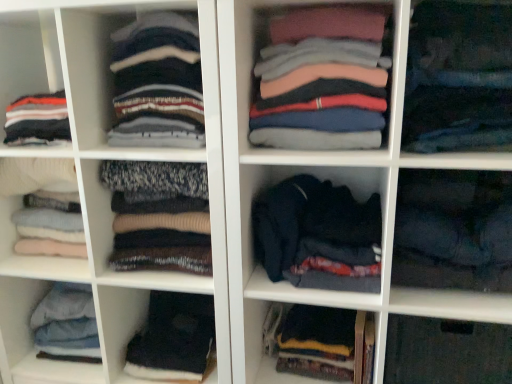
What do you see at coordinates (33, 174) in the screenshot?
I see `knit sweater at left, which is the 1th clothing from left to right` at bounding box center [33, 174].

Image resolution: width=512 pixels, height=384 pixels. What do you see at coordinates (321, 80) in the screenshot?
I see `pink cotton shirts at center, the fifth clothing viewed from the left` at bounding box center [321, 80].

This screenshot has width=512, height=384. Identify the location of pink cotton shirts at center, the fifth clothing viewed from the left. (321, 80).

What do you see at coordinates (453, 230) in the screenshot? I see `dark blue fabric at lower right, which ranks as the ninth clothing in left-to-right order` at bounding box center [453, 230].

Identify the location of dark blue fabric pants at center, which is counted as the eighth clothing, starting from the left. The width and height of the screenshot is (512, 384). (458, 78).

Image resolution: width=512 pixels, height=384 pixels. Describe the element at coordinates (157, 83) in the screenshot. I see `knit sweater at center, acting as the seventh clothing starting from the right` at that location.

Find the location of `dark blue fabric at lower center, which is the 6th clothing in left-to-right order`. dark blue fabric at lower center, which is the 6th clothing in left-to-right order is located at coordinates (321, 342).

This screenshot has height=384, width=512. What are the coordinates of `knit sweater at left, the ninth clothing in the right-to-left sequence` in the screenshot? It's located at (33, 174).

From the image's perspective, which is below, dark blue fabric at lower center, acting as the fourth clothing starting from the right, or knit sweater at left, which is the 1th clothing from left to right?

dark blue fabric at lower center, acting as the fourth clothing starting from the right, is shown below in the image.

Which point is more forward, (347, 325) or (70, 166)?

The point (70, 166) is more forward.

Visually, is dark blue fabric at lower center, which is the 6th clothing in left-to-right order, positioned to the left or to the right of knit sweater at left, the ninth clothing in the right-to-left sequence?

Based on their positions, dark blue fabric at lower center, which is the 6th clothing in left-to-right order, is located to the right of knit sweater at left, the ninth clothing in the right-to-left sequence.

Which point is more forward, (337, 55) or (1, 182)?

The point (337, 55) is closer.

What's the angular difference between pink cotton shirts at center, the fifth clothing viewed from the left, and knit sweater at left, the ninth clothing in the right-to-left sequence,'s facing directions?

The angle between the facing direction of pink cotton shirts at center, the fifth clothing viewed from the left, and the facing direction of knit sweater at left, the ninth clothing in the right-to-left sequence, is 0.000122 degrees.

Is pink cotton shirts at center, which is the fifth clothing from right to left, facing towards knit sweater at left, the ninth clothing in the right-to-left sequence?

No, pink cotton shirts at center, which is the fifth clothing from right to left, is not facing towards knit sweater at left, the ninth clothing in the right-to-left sequence.

Which of these two, dark blue sweater at center or pink cotton shirts at center, which is the fifth clothing from right to left, is smaller?

pink cotton shirts at center, which is the fifth clothing from right to left.

Is dark blue sweater at center to the left of pink cotton shirts at center, the fifth clothing viewed from the left, from the viewer's perspective?

Yes.

Is dark blue sweater at center aimed at pink cotton shirts at center, the fifth clothing viewed from the left?

No, dark blue sweater at center is not facing towards pink cotton shirts at center, the fifth clothing viewed from the left.

Which object is more forward, dark blue sweater at center or pink cotton shirts at center, the fifth clothing viewed from the left?

dark blue sweater at center.

From the picture: Is dark blue fabric at center, which is the 7th clothing in left-to-right order, at the back of dark blue fabric at lower center, which is the 6th clothing in left-to-right order?

No, dark blue fabric at center, which is the 7th clothing in left-to-right order, is not at the back of dark blue fabric at lower center, which is the 6th clothing in left-to-right order.

Is dark blue fabric at lower center, acting as the fourth clothing starting from the right, next to dark blue fabric at center, the third clothing viewed from the right?

No, dark blue fabric at lower center, acting as the fourth clothing starting from the right, is not with dark blue fabric at center, the third clothing viewed from the right.

Which object is more forward, dark blue fabric at lower center, which is the 6th clothing in left-to-right order, or dark blue fabric at center, which is the 7th clothing in left-to-right order?

Positioned in front is dark blue fabric at center, which is the 7th clothing in left-to-right order.

Is dark blue fabric at lower right, which ranks as the ninth clothing in left-to-right order, thinner than dark blue fabric pants at center, the second clothing viewed from the right?

No.

Considering the positions of objects dark blue fabric at lower right, the first clothing when ordered from right to left, and dark blue fabric pants at center, the second clothing viewed from the right, in the image provided, who is more to the left, dark blue fabric at lower right, the first clothing when ordered from right to left, or dark blue fabric pants at center, the second clothing viewed from the right,?

From the viewer's perspective, dark blue fabric pants at center, the second clothing viewed from the right, appears more on the left side.

Are dark blue fabric at lower right, which ranks as the ninth clothing in left-to-right order, and dark blue fabric pants at center, the second clothing viewed from the right, far apart?

No, dark blue fabric at lower right, which ranks as the ninth clothing in left-to-right order, is not far from dark blue fabric pants at center, the second clothing viewed from the right.

From a real-world perspective, is dark blue fabric at lower right, which ranks as the ninth clothing in left-to-right order, under dark blue fabric pants at center, the second clothing viewed from the right?

Correct, in the physical world, dark blue fabric at lower right, which ranks as the ninth clothing in left-to-right order, is lower than dark blue fabric pants at center, the second clothing viewed from the right.

From a real-world perspective, who is located lower, knit sweater at center, acting as the second clothing starting from the left, or dark blue fabric at lower right, the first clothing when ordered from right to left?

knit sweater at center, acting as the second clothing starting from the left, from a real-world perspective.

Which clothing is the 4th one when counting from the front of the knit sweater at center, acting as the second clothing starting from the left? Please provide its 2D coordinates.

[(453, 230)]

From the image's perspective, is knit sweater at center, placed as the 8th clothing when sorted from right to left, located above or below dark blue fabric at lower right, the first clothing when ordered from right to left?

Clearly, from the image's perspective, knit sweater at center, placed as the 8th clothing when sorted from right to left, is above dark blue fabric at lower right, the first clothing when ordered from right to left.

In the scene shown: Is knit sweater at center, acting as the second clothing starting from the left, positioned with its back to dark blue fabric at lower right, which ranks as the ninth clothing in left-to-right order?

No, knit sweater at center, acting as the second clothing starting from the left, is not facing the opposite direction of dark blue fabric at lower right, which ranks as the ninth clothing in left-to-right order.

Considering the positions of objects dark blue fabric at center, the third clothing viewed from the right, and dark blue sweater at center in the image provided, who is more to the right, dark blue fabric at center, the third clothing viewed from the right, or dark blue sweater at center?

Positioned to the right is dark blue fabric at center, the third clothing viewed from the right.

Is dark blue fabric at center, the third clothing viewed from the right, positioned far away from dark blue sweater at center?

They are positioned close to each other.

Who is bigger, dark blue fabric at center, which is the 7th clothing in left-to-right order, or dark blue sweater at center?

Bigger between the two is dark blue sweater at center.

Which is nearer, (289, 244) or (88, 253)?

The point (289, 244) is more forward.

From the knit sweater at left, the ninth clothing in the right-to-left sequence, count 2nd clothings backward and point to it. Please provide its 2D coordinates.

[(321, 342)]

Locate an element on the screen. This screenshot has height=384, width=512. the 2nd clothing above the knit sweater at left, the ninth clothing in the right-to-left sequence (from the image's perspective) is located at coordinates (321, 80).

Estimate the real-world distances between objects in this image. Which object is closer to dark blue fabric pants at center, the second clothing viewed from the right, black fabric at lower left, positioned as the fourth clothing in left-to-right order, or knit sweater at center, acting as the seventh clothing starting from the right?

knit sweater at center, acting as the seventh clothing starting from the right.

When comparing their distances from transparent plastic shelf at lower right, does dark blue sweater at center or knit sweater at left, which is the 1th clothing from left to right, seem closer?

dark blue sweater at center is positioned closer to the anchor transparent plastic shelf at lower right.

Consider the image. Looking at the image, which one is located further to dark blue fabric at lower center, which is the 6th clothing in left-to-right order, knit sweater at left, which is the 1th clothing from left to right, or black fabric at lower left, arranged as the sixth clothing when viewed from the right?

Among the two, knit sweater at left, which is the 1th clothing from left to right, is located further to dark blue fabric at lower center, which is the 6th clothing in left-to-right order.

Looking at this image, based on their spatial positions, is dark blue fabric at center, the third clothing viewed from the right, or knit sweater at center, acting as the second clothing starting from the left, further from knit sweater at center, acting as the seventh clothing starting from the right?

dark blue fabric at center, the third clothing viewed from the right.

Which object lies nearer to the anchor point dark blue sweater at center, transparent plastic shelf at lower right or dark blue fabric at lower right, the first clothing when ordered from right to left?

dark blue fabric at lower right, the first clothing when ordered from right to left, is positioned closer to the anchor dark blue sweater at center.

From the image, which object appears to be nearer to dark blue fabric pants at center, the second clothing viewed from the right, dark blue fabric at lower center, acting as the fourth clothing starting from the right, or transparent plastic shelf at lower right?

The object closer to dark blue fabric pants at center, the second clothing viewed from the right, is transparent plastic shelf at lower right.

When comparing their distances from dark blue fabric at lower right, the first clothing when ordered from right to left, does pink cotton shirts at center, the fifth clothing viewed from the left, or dark blue fabric at lower center, acting as the fourth clothing starting from the right, seem closer?

Among the two, pink cotton shirts at center, the fifth clothing viewed from the left, is located nearer to dark blue fabric at lower right, the first clothing when ordered from right to left.

From the image, which object appears to be nearer to dark blue fabric at lower center, which is the 6th clothing in left-to-right order, knit sweater at left, the ninth clothing in the right-to-left sequence, or dark blue fabric at lower right, the first clothing when ordered from right to left?

dark blue fabric at lower right, the first clothing when ordered from right to left.

The height and width of the screenshot is (384, 512). I want to click on shelf between knit sweater at left, the ninth clothing in the right-to-left sequence, and knit sweater at center, placed as the 8th clothing when sorted from right to left, so click(95, 181).

Where is `clothing between knit sweater at left, the ninth clothing in the right-to-left sequence, and knit sweater at center, arranged as the 3th clothing when viewed from the left, in the horizontal direction`? The image size is (512, 384). clothing between knit sweater at left, the ninth clothing in the right-to-left sequence, and knit sweater at center, arranged as the 3th clothing when viewed from the left, in the horizontal direction is located at coordinates [159, 216].

I want to click on shelf between knit sweater at left, the ninth clothing in the right-to-left sequence, and dark blue fabric pants at center, which is counted as the eighth clothing, starting from the left, in the horizontal direction, so click(x=95, y=181).

The height and width of the screenshot is (384, 512). In order to click on cabinet between pink cotton shirts at center, the fifth clothing viewed from the left, and dark blue fabric at lower center, which is the 6th clothing in left-to-right order, from top to bottom in this screenshot , I will do `click(447, 352)`.